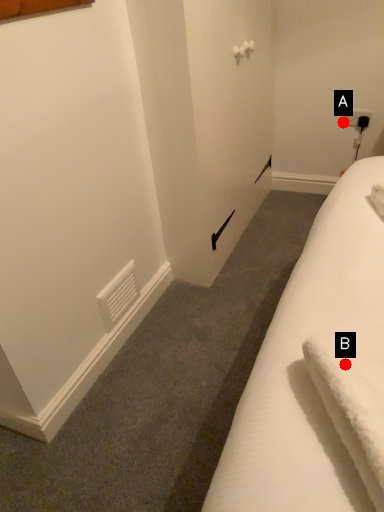
Question: Two points are circled on the image, labeled by A and B beside each circle. Which point is farther from the camera taking this photo?

Choices:
 (A) A is further
 (B) B is further

Answer: (A)